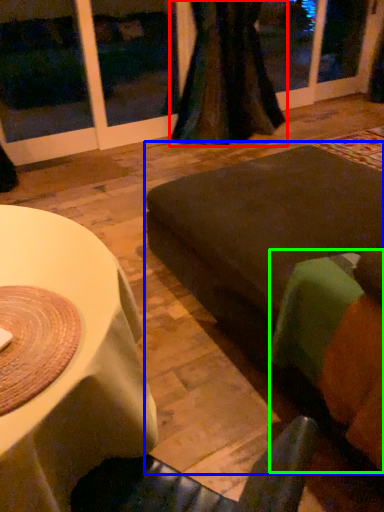
Question: Which object is positioned closest to curtain (highlighted by a red box)? Select from couch (highlighted by a blue box) and couch (highlighted by a green box).

Choices:
 (A) couch
 (B) couch

Answer: (A)